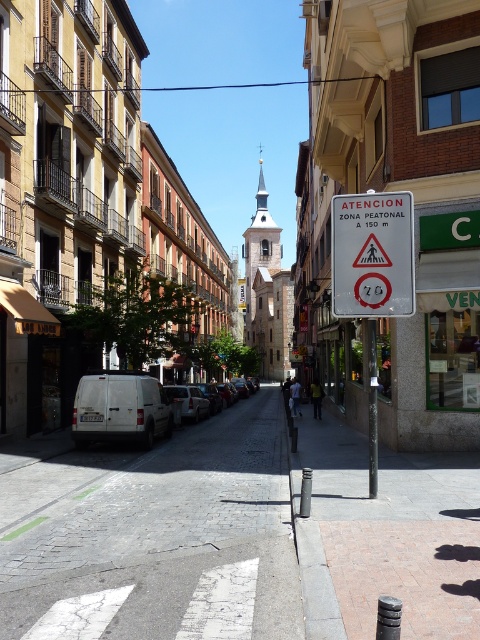
Looking at this image, you are driving a metallic silver van at center in a narrow urban street. You need to park it near the gray cobblestone pavement at center. Is there enough space between the van and the pavement to park safely?

The gray cobblestone pavement at center is 12.89 meters away from the metallic silver van at center. Since parking requires only a few meters of space, there is sufficient distance to park safely.

You are a delivery drone flying over an urban area. You need to land on a smooth concrete bollard at center. The landing coordinates are given as point (385, 536). Is this point on the bollard?

Yes, the point (385, 536) is on the smooth concrete bollard at center, so the drone can land there.

You are a delivery person trying to park your metallic silver van at center in the narrow urban street. The gray cobblestone pavement at center is where you want to park. According to the scene description, can the van fit on the pavement? Please explain using the spatial relationship between the two objects.

The gray cobblestone pavement at center is above the metallic silver van at center, meaning the pavement is elevated or positioned higher than the van. Since the pavement is above the van, it might not provide enough space for the van to park there. The van may need to find another location with a flat or level surface.